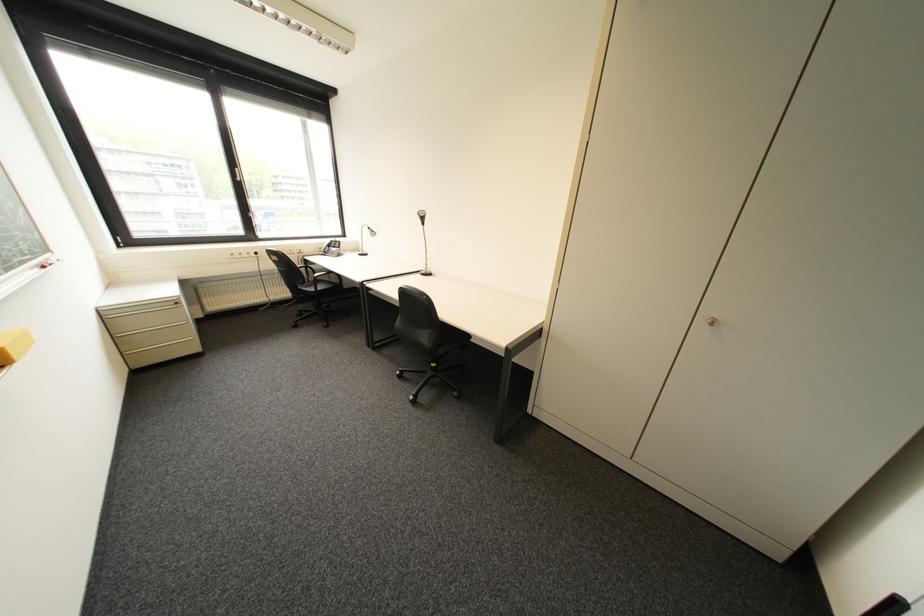
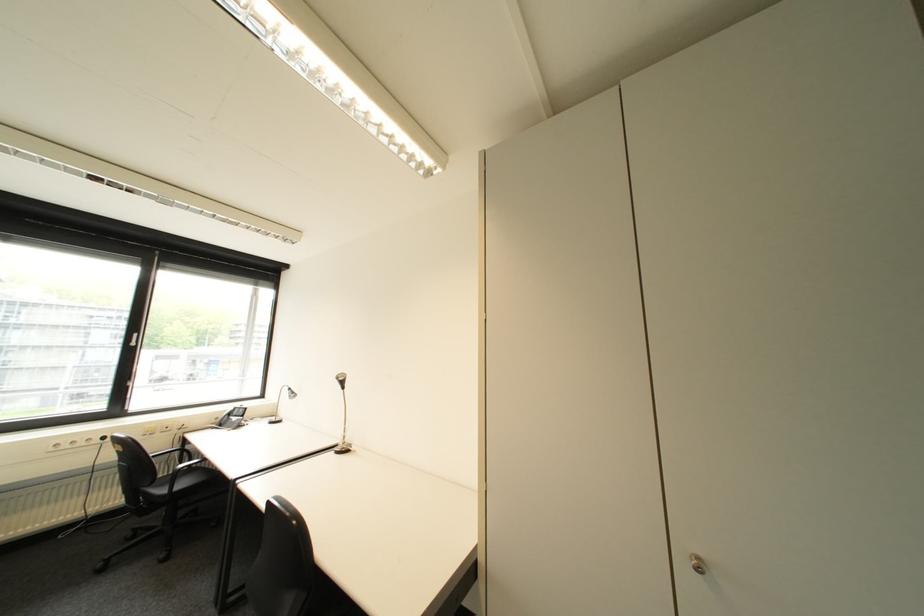
In the second image, find the point that corresponds to pixel 266 254 in the first image.

(114, 439)